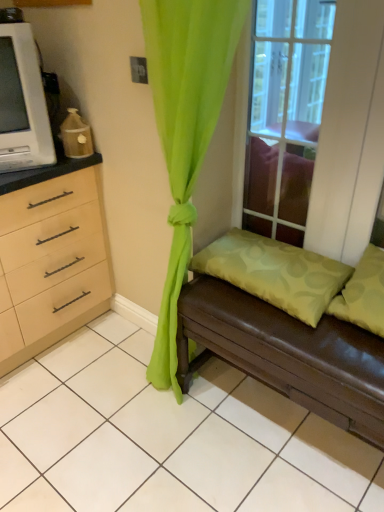
Question: Considering the positions of green sheer curtain at center and brown leather studio couch at lower right in the image, is green sheer curtain at center bigger or smaller than brown leather studio couch at lower right?

Choices:
 (A) small
 (B) big

Answer: (A)

Question: From the image's perspective, is green sheer curtain at center located above or below brown leather studio couch at lower right?

Choices:
 (A) below
 (B) above

Answer: (B)

Question: Considering the real-world distances, which object is closest to the green fabric pillow at lower right, which is the 1th pillow from left to right?

Choices:
 (A) brown leather studio couch at lower right
 (B) white plastic microwave at left
 (C) green fabric pillow at right, the second pillow when ordered from left to right
 (D) clear glass window at upper center
 (E) green sheer curtain at center

Answer: (A)

Question: Based on their relative distances, which object is farther from the brown leather studio couch at lower right?

Choices:
 (A) green sheer curtain at center
 (B) clear glass window at upper center
 (C) green fabric pillow at lower right, which is the 1th pillow from left to right
 (D) green fabric pillow at right, which is the first pillow in right-to-left order
 (E) white plastic microwave at left

Answer: (E)